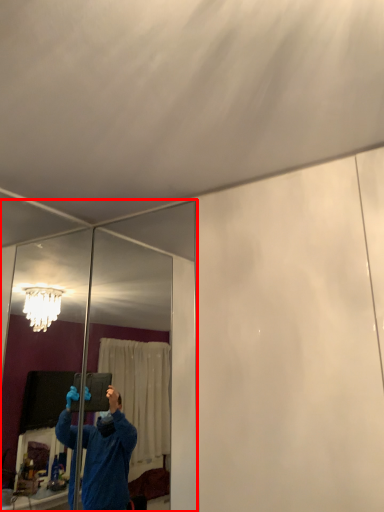
Question: From the image's perspective, where is mirror (annotated by the red box) located in relation to mirror in the image?

Choices:
 (A) below
 (B) above

Answer: (A)